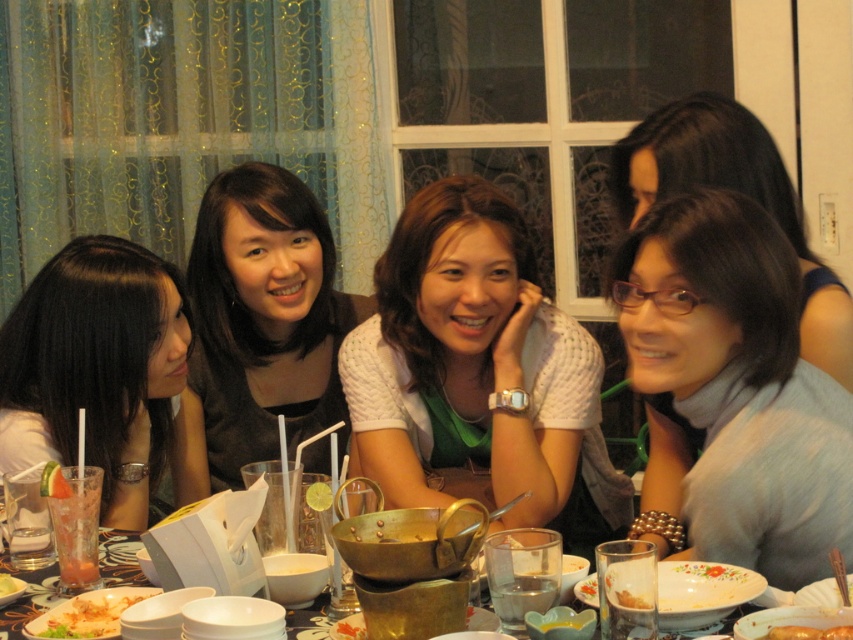
Question: Can you confirm if white glossy plate at lower left is bigger than smooth brown sausage at center?

Choices:
 (A) yes
 (B) no

Answer: (A)

Question: Can you confirm if matte black hair at center is positioned above smooth brown sausage at center?

Choices:
 (A) yes
 (B) no

Answer: (A)

Question: Among these objects, which one is farthest from the camera?

Choices:
 (A) clear glass drink at lower left
 (B) smooth black hair at left

Answer: (B)

Question: Is metallic gold bowl at center wider than clear glass water at table center?

Choices:
 (A) yes
 (B) no

Answer: (A)

Question: Estimate the real-world distances between objects in this image. Which object is closer to the matte black hair at center?

Choices:
 (A) smooth brown sausage at center
 (B) white glossy plate at lower left

Answer: (A)

Question: Which object is the closest to the smooth white bowl at center?

Choices:
 (A) white glossy plate at lower left
 (B) clear glass water at table center
 (C) smooth brown sausage at center

Answer: (A)